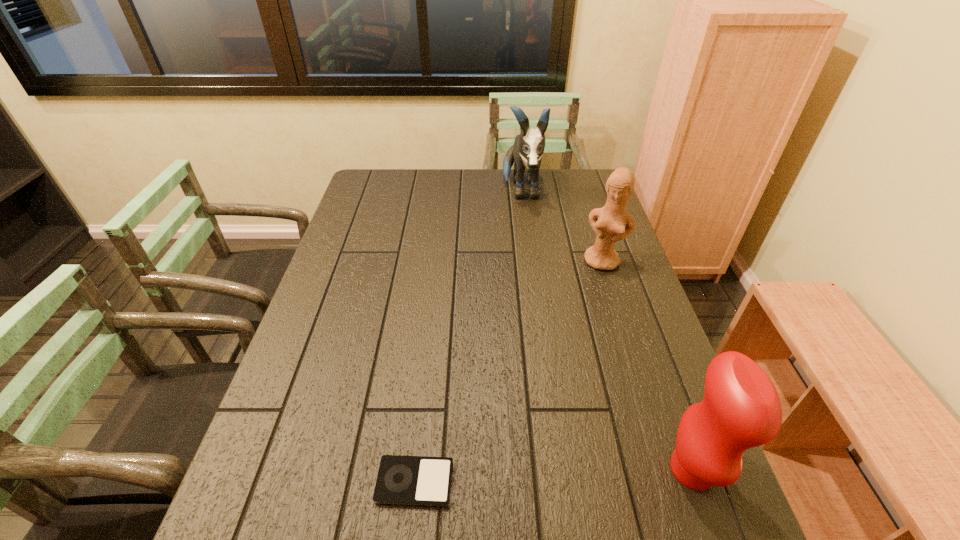
Locate an element on the screen. The image size is (960, 540). vacant area situated on the front-facing side of the tallest object is located at coordinates (531, 265).

Locate an element on the screen. vacant space located on the front-facing side of the tallest object is located at coordinates (527, 238).

The width and height of the screenshot is (960, 540). In order to click on blank space located 0.330m on the front-facing side of the tallest object in this screenshot , I will do `click(533, 279)`.

This screenshot has height=540, width=960. Find the location of `object located at the far edge`. object located at the far edge is located at coordinates (529, 145).

Locate an element on the screen. This screenshot has height=540, width=960. iPod that is at the near edge is located at coordinates (402, 480).

The image size is (960, 540). Find the location of `condiment positioned at the near edge`. condiment positioned at the near edge is located at coordinates (741, 409).

The width and height of the screenshot is (960, 540). I want to click on condiment situated at the right edge, so click(x=741, y=409).

Image resolution: width=960 pixels, height=540 pixels. Identify the location of figurine situated at the right edge. (608, 222).

Identify the location of object at the near right corner. The image size is (960, 540). (741, 409).

In the image, there is a desktop. Where is `vacant space at the far edge`? This screenshot has width=960, height=540. vacant space at the far edge is located at coordinates (x=464, y=184).